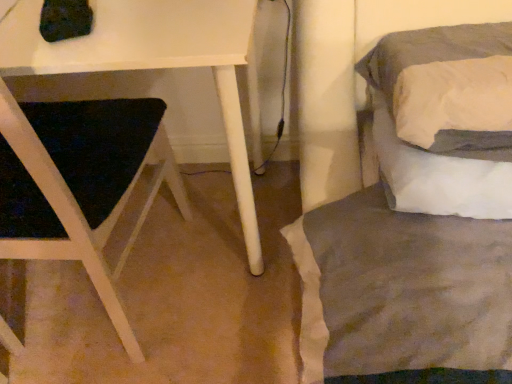
You are a GUI agent. You are given a task and a screenshot of the screen. Output one action in this format:
    pyautogui.click(x=<x>, y=<y>)
    Task: Click on the white matte table at left
    
    Given the screenshot: What is the action you would take?
    pyautogui.click(x=153, y=62)

What do you see at coordinates (153, 62) in the screenshot? I see `white matte table at left` at bounding box center [153, 62].

Measure the distance between gray fabric bed at right and camera.

28.48 inches.

I want to click on gray fabric bed at right, so click(445, 118).

What is the approximate height of gray fabric bed at right?

6.39 inches.

The height and width of the screenshot is (384, 512). Describe the element at coordinates (445, 118) in the screenshot. I see `gray fabric bed at right` at that location.

Locate an element on the screen. Image resolution: width=512 pixels, height=384 pixels. white matte table at left is located at coordinates (153, 62).

Considering the relative positions of white matte table at left and gray fabric bed at right in the image provided, is white matte table at left to the right of gray fabric bed at right from the viewer's perspective?

No, white matte table at left is not to the right of gray fabric bed at right.

Relative to gray fabric bed at right, is white matte table at left in front or behind?

Clearly, white matte table at left is behind gray fabric bed at right.

Based on the photo, which is less distant, (115, 23) or (469, 209)?

Point (115, 23) is closer to the camera than point (469, 209).

From the image's perspective, between white matte table at left and gray fabric bed at right, who is located below?

white matte table at left, from the image's perspective.

From a real-world perspective, which is physically below, white matte table at left or gray fabric bed at right?

In real-world perspective, white matte table at left is lower.

Can you confirm if white matte table at left is wider than gray fabric bed at right?

Indeed, white matte table at left has a greater width compared to gray fabric bed at right.

Can you confirm if white matte table at left is taller than gray fabric bed at right?

Indeed, white matte table at left has a greater height compared to gray fabric bed at right.

Considering the relative sizes of white matte table at left and gray fabric bed at right in the image provided, is white matte table at left bigger than gray fabric bed at right?

Indeed, white matte table at left has a larger size compared to gray fabric bed at right.

Would you say gray fabric bed at right is part of white matte table at left's contents?

No, white matte table at left does not contain gray fabric bed at right.

Is white matte table at left not close to gray fabric bed at right?

No.

From the picture: Is white matte table at left aimed at gray fabric bed at right?

No, white matte table at left is not facing towards gray fabric bed at right.

How different are the orientations of white matte table at left and gray fabric bed at right in degrees?

0.632 degrees.

I want to click on bed lying in front of the white matte table at left, so click(445, 118).

Which is more to the left, gray fabric bed at right or white matte table at left?

white matte table at left is more to the left.

In the image, is gray fabric bed at right positioned in front of or behind white matte table at left?

Clearly, gray fabric bed at right is in front of white matte table at left.

Is point (414, 180) positioned behind point (17, 43)?

Yes, point (414, 180) is farther from viewer.

From the image's perspective, which is below, gray fabric bed at right or white matte table at left?

white matte table at left, from the image's perspective.

From a real-world perspective, between gray fabric bed at right and white matte table at left, who is vertically higher?

gray fabric bed at right, from a real-world perspective.

Is gray fabric bed at right thinner than white matte table at left?

Yes, gray fabric bed at right is thinner than white matte table at left.

Which of these two, gray fabric bed at right or white matte table at left, stands shorter?

gray fabric bed at right is shorter.

Based on the photo, is gray fabric bed at right bigger or smaller than white matte table at left?

In the image, gray fabric bed at right appears to be smaller than white matte table at left.

Can white matte table at left be found inside gray fabric bed at right?

Definitely not — white matte table at left is not inside gray fabric bed at right.

Is gray fabric bed at right directly adjacent to white matte table at left?

There is a gap between gray fabric bed at right and white matte table at left.

Is gray fabric bed at right facing away from white matte table at left?

gray fabric bed at right does not have its back to white matte table at left.

What's the angular difference between gray fabric bed at right and white matte table at left's facing directions?

gray fabric bed at right and white matte table at left are facing 0.632 degrees away from each other.

You are a GUI agent. You are given a task and a screenshot of the screen. Output one action in this format:
    pyautogui.click(x=<x>, y=<y>)
    Task: Click on the bed located above the white matte table at left (from a real-world perspective)
    The height and width of the screenshot is (384, 512).
    Given the screenshot: What is the action you would take?
    pyautogui.click(x=445, y=118)

Find the location of `bed above the white matte table at left (from a real-world perspective)`. bed above the white matte table at left (from a real-world perspective) is located at coordinates (445, 118).

I want to click on table that is on the left side of gray fabric bed at right, so click(153, 62).